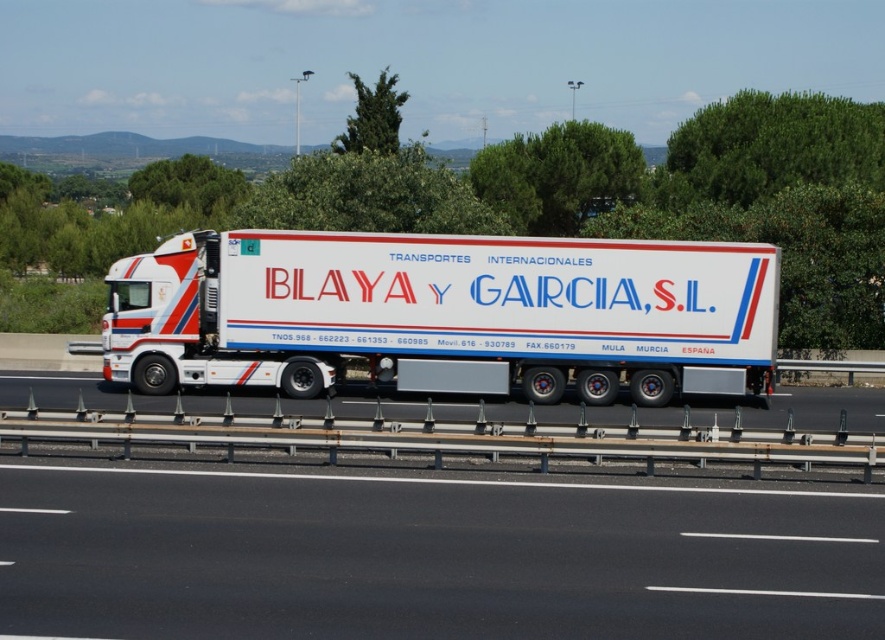
You are a driver observing the black asphalt road at center and the white glossy trailer at center from the passenger seat. Which object appears larger in your view?

The white glossy trailer at center appears larger than the black asphalt road at center in your view because the white glossy trailer at center is described as larger.

You are a drone operator trying to capture the semi truck on the highway. The drone is currently hovering above the black asphalt road at center. To get a clear shot of the truck, should you move north or south from your current position?

The black asphalt road at center is located at point (x=428, y=557). Since the truck is driving on the road, you should move north or south along the road to position the drone for a clear shot, ensuring you stay within the road area.